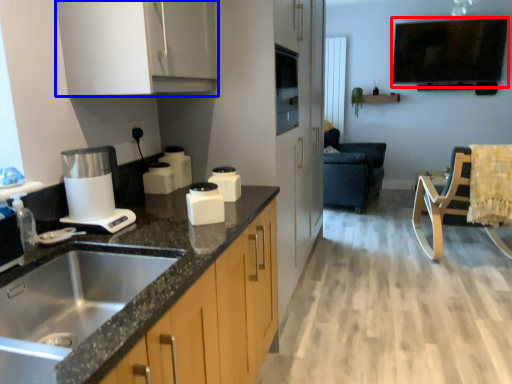
Question: Which point is further to the camera, window screen (highlighted by a red box) or cabinetry (highlighted by a blue box)?

Choices:
 (A) window screen
 (B) cabinetry

Answer: (A)